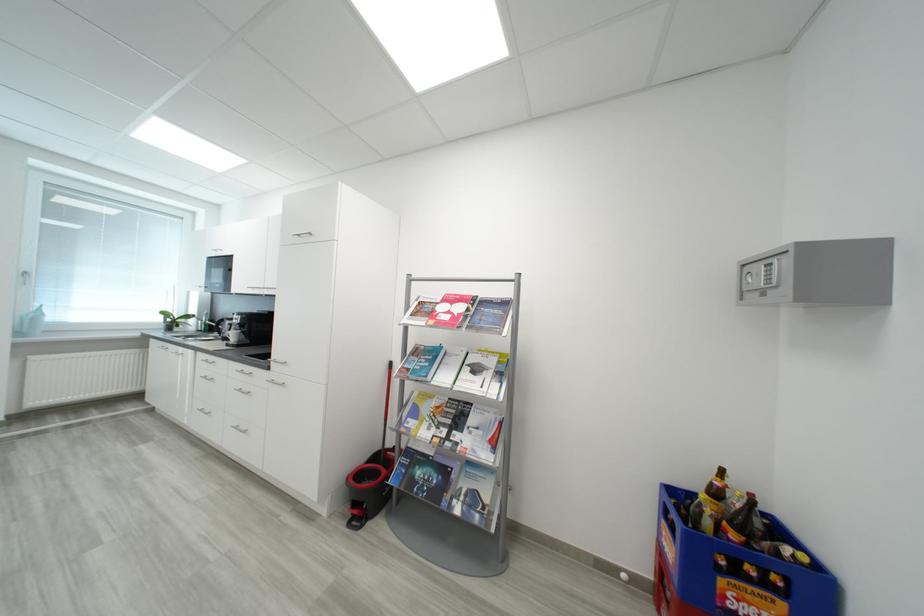
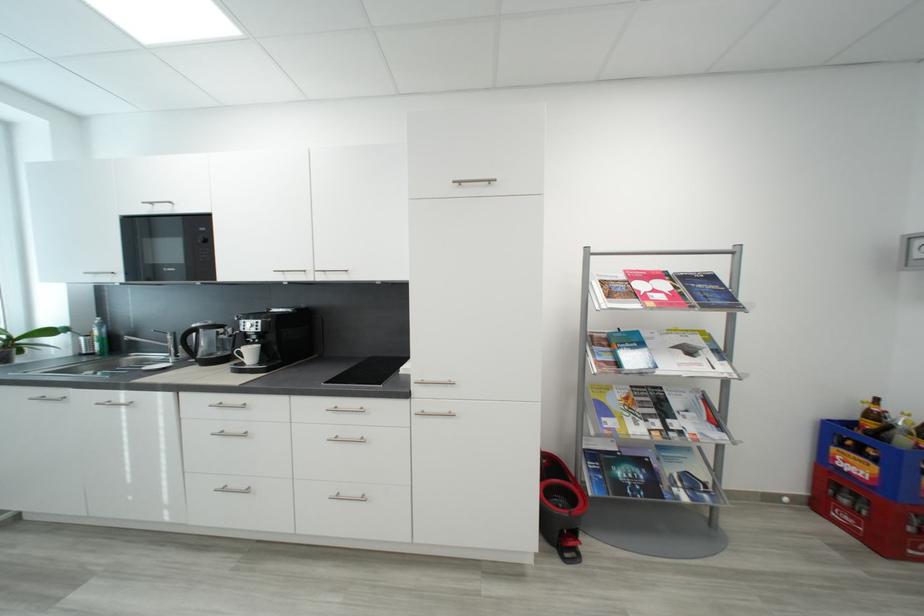
In the second image, find the point that corresponds to point 679,530 in the first image.

(867, 454)